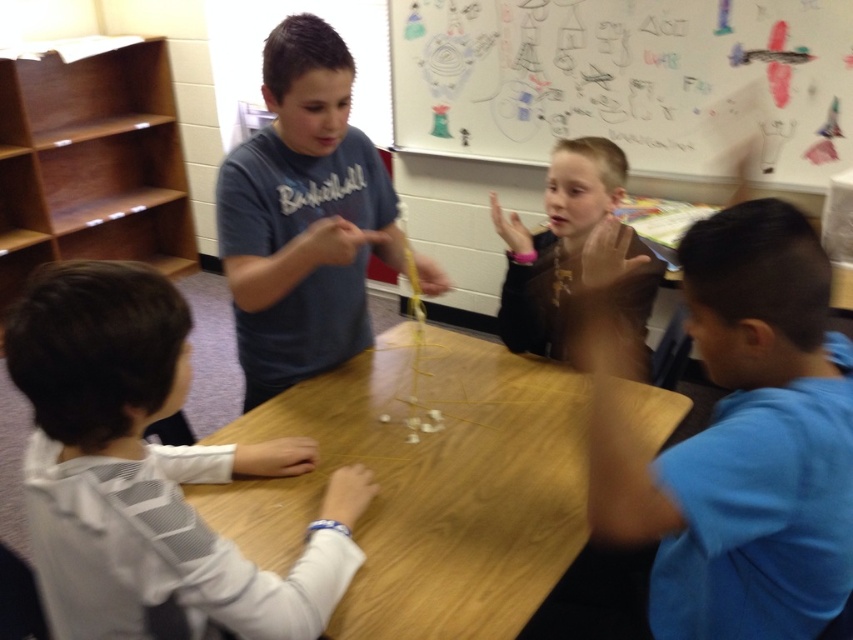
Based on the scene described, which object is taller between the matte gray shirt at center and the dark brown leather jacket at center?

The matte gray shirt at center is taller than the dark brown leather jacket at center according to the description.